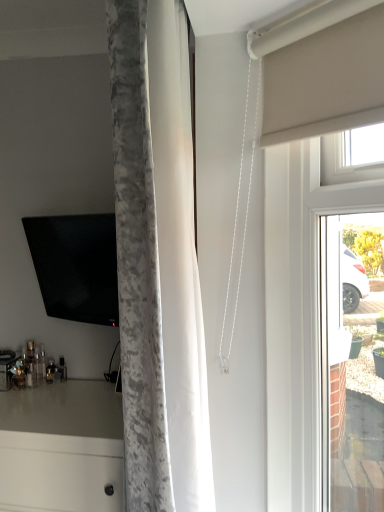
Question: From the image's perspective, would you say white glossy countertop at lower left is positioned over matte black tv at left?

Choices:
 (A) no
 (B) yes

Answer: (A)

Question: Is white glossy countertop at lower left at the right side of matte black tv at left?

Choices:
 (A) no
 (B) yes

Answer: (A)

Question: Is white glossy countertop at lower left thinner than matte black tv at left?

Choices:
 (A) no
 (B) yes

Answer: (A)

Question: Does white glossy countertop at lower left touch matte black tv at left?

Choices:
 (A) no
 (B) yes

Answer: (A)

Question: Is white glossy countertop at lower left facing away from matte black tv at left?

Choices:
 (A) no
 (B) yes

Answer: (A)

Question: Does white glossy countertop at lower left lie behind matte black tv at left?

Choices:
 (A) no
 (B) yes

Answer: (A)

Question: Does matte black tv at left have a greater width compared to white glossy countertop at lower left?

Choices:
 (A) yes
 (B) no

Answer: (B)

Question: Is matte black tv at left aimed at white glossy countertop at lower left?

Choices:
 (A) no
 (B) yes

Answer: (A)

Question: Is matte black tv at left smaller than white glossy countertop at lower left?

Choices:
 (A) no
 (B) yes

Answer: (B)

Question: Can you confirm if matte black tv at left is taller than white glossy countertop at lower left?

Choices:
 (A) yes
 (B) no

Answer: (B)

Question: Could white glossy countertop at lower left be considered to be inside matte black tv at left?

Choices:
 (A) yes
 (B) no

Answer: (B)

Question: From a real-world perspective, is matte black tv at left positioned under white glossy countertop at lower left based on gravity?

Choices:
 (A) no
 (B) yes

Answer: (A)

Question: From the image's perspective, does white glossy countertop at lower left appear lower than matte white glass door at right?

Choices:
 (A) yes
 (B) no

Answer: (A)